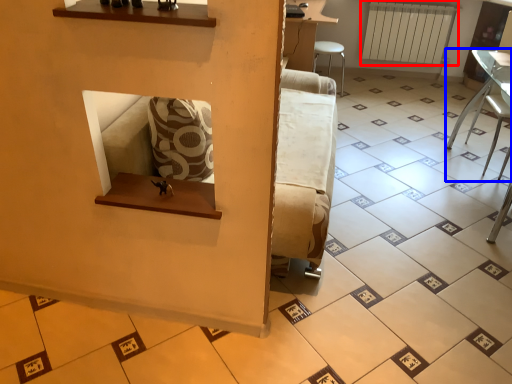
Question: Which object appears farthest to the camera in this image, radiator (highlighted by a red box) or furniture (highlighted by a blue box)?

Choices:
 (A) radiator
 (B) furniture

Answer: (A)